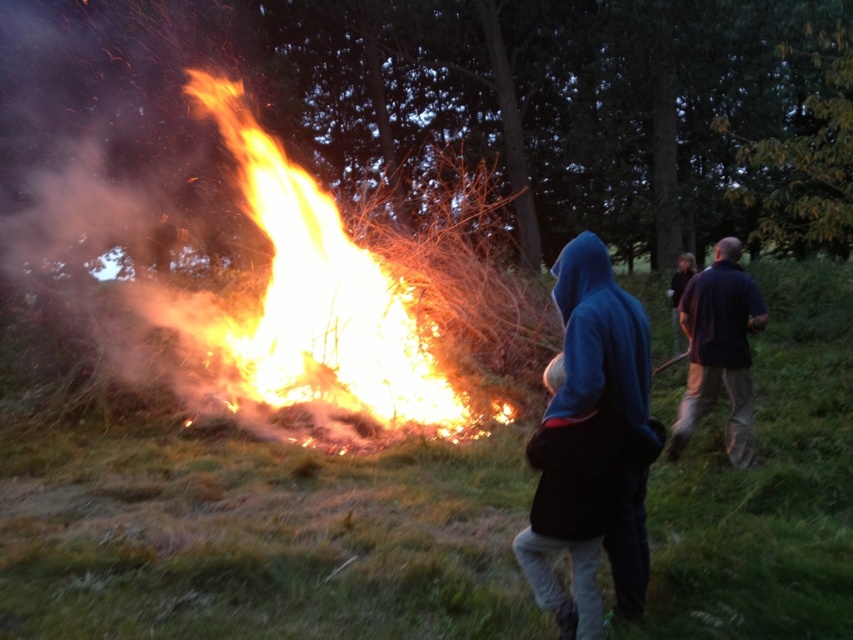
Question: Is dark blue hoodie at center to the right of dark blue shirt at right from the viewer's perspective?

Choices:
 (A) yes
 (B) no

Answer: (B)

Question: Which point is closer to the camera?

Choices:
 (A) (654, 436)
 (B) (666, 444)
 (C) (567, 616)
 (D) (242, 136)

Answer: (A)

Question: Does blue fleece jacket at center appear over dark blue hoodie at center?

Choices:
 (A) yes
 (B) no

Answer: (A)

Question: Which object is farther from the camera taking this photo?

Choices:
 (A) flaming wood at center
 (B) blue fleece jacket at center
 (C) dark blue shirt at right
 (D) dark blue hoodie at center

Answer: (A)

Question: Which of these objects is positioned farthest from the dark blue hoodie at center?

Choices:
 (A) blue fleece jacket at center
 (B) flaming wood at center
 (C) dark blue shirt at right

Answer: (B)

Question: Is dark blue hoodie at center behind dark blue shirt at right?

Choices:
 (A) yes
 (B) no

Answer: (B)